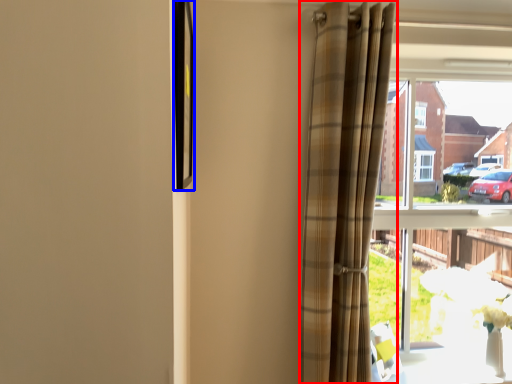
Question: Which of the following is the farthest to the observer, curtain (highlighted by a red box) or picture frame (highlighted by a blue box)?

Choices:
 (A) curtain
 (B) picture frame

Answer: (A)